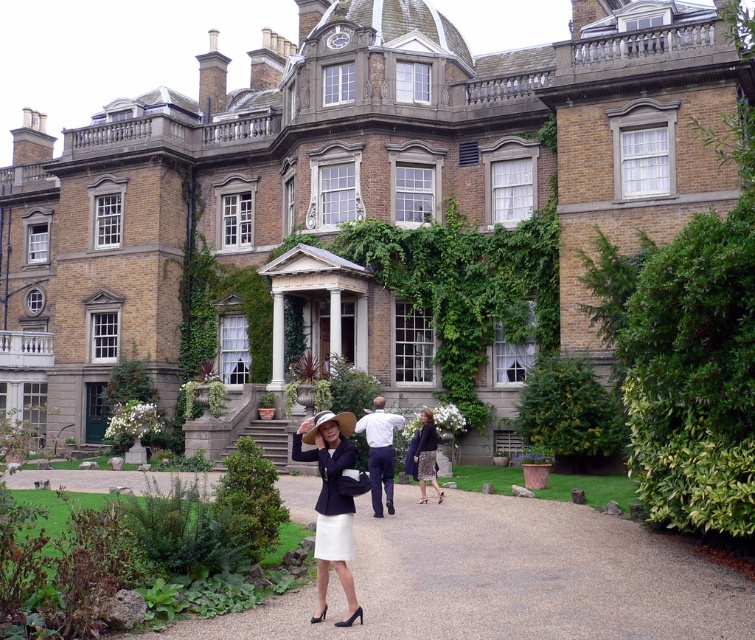
Between brown brick mansion at center and white cotton shirt at center, which one appears on the left side from the viewer's perspective?

From the viewer's perspective, brown brick mansion at center appears more on the left side.

Which is behind, point (359, 77) or point (378, 456)?

Point (359, 77)

Where is `brown brick mansion at center`? brown brick mansion at center is located at coordinates (344, 182).

Can you confirm if white gravel path at center is wider than dark gray skirt at center?

Yes, white gravel path at center is wider than dark gray skirt at center.

In order to click on white gravel path at center in this screenshot , I will do `click(507, 579)`.

The image size is (755, 640). I want to click on white gravel path at center, so click(507, 579).

In order to click on white gravel path at center in this screenshot , I will do pyautogui.click(x=507, y=579).

Is white gravel path at center smaller than white cotton shirt at center?

Incorrect, white gravel path at center is not smaller in size than white cotton shirt at center.

Does white gravel path at center have a larger size compared to white cotton shirt at center?

Yes, white gravel path at center is bigger than white cotton shirt at center.

At what (x,y) coordinates should I click in order to perform the action: click on white gravel path at center. Please return your answer as a coordinate pair (x, y). Image resolution: width=755 pixels, height=640 pixels. Looking at the image, I should click on (507, 579).

Identify the location of white gravel path at center. The height and width of the screenshot is (640, 755). (507, 579).